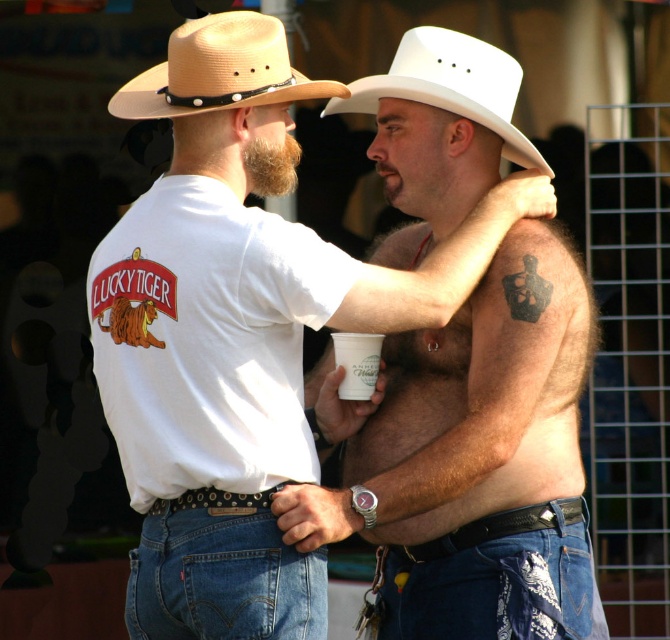
From the picture: You are standing in the image and want to find the denim jeans at lower right. According to the coordinates provided, where exactly should you look?

The denim jeans at lower right are located at the coordinates point (490, 580).

You are a photographer trying to capture a clear photo of the white paper cup at upper center. However, the tan straw hat at upper left is blocking your view. Can you move the hat to the side so that the cup becomes visible?

The tan straw hat at upper left is in front of the white paper cup at upper center, so moving the hat to the side would allow the cup to become visible.